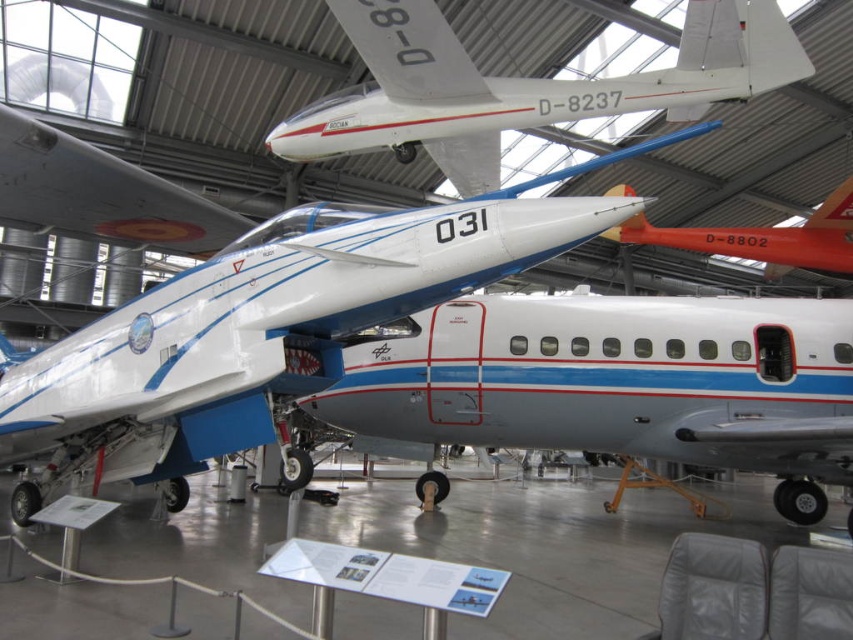
Image resolution: width=853 pixels, height=640 pixels. In order to click on white glossy airplane at upper center in this screenshot , I will do `click(520, 86)`.

Can you confirm if white glossy airplane at upper center is positioned below orange glossy airplane at center?

No, white glossy airplane at upper center is not below orange glossy airplane at center.

Image resolution: width=853 pixels, height=640 pixels. What are the coordinates of `white glossy airplane at upper center` in the screenshot? It's located at (520, 86).

Is point (13, 381) farther from camera compared to point (819, 262)?

Yes, it is behind point (819, 262).

Does white glossy airplane at center have a smaller size compared to orange glossy airplane at center?

Actually, white glossy airplane at center might be larger than orange glossy airplane at center.

Who is more distant from viewer, (25, 522) or (845, 196)?

Point (845, 196)

Locate an element on the screen. white glossy airplane at center is located at coordinates (271, 323).

Can you confirm if white glossy airplane at center is shorter than white glossy airplane at upper center?

In fact, white glossy airplane at center may be taller than white glossy airplane at upper center.

Does point (113, 355) come closer to viewer compared to point (463, 125)?

No, (113, 355) is further to viewer.

Between point (148, 291) and point (490, 182), which one is positioned in front?

Point (490, 182) is in front.

The image size is (853, 640). What are the coordinates of `white glossy airplane at center` in the screenshot? It's located at (271, 323).